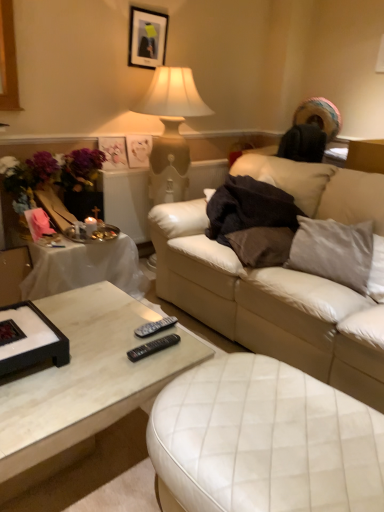
The height and width of the screenshot is (512, 384). I want to click on free space to the left of black plastic remote at lower center, which is counted as the 1th remote, starting from the front, so click(103, 351).